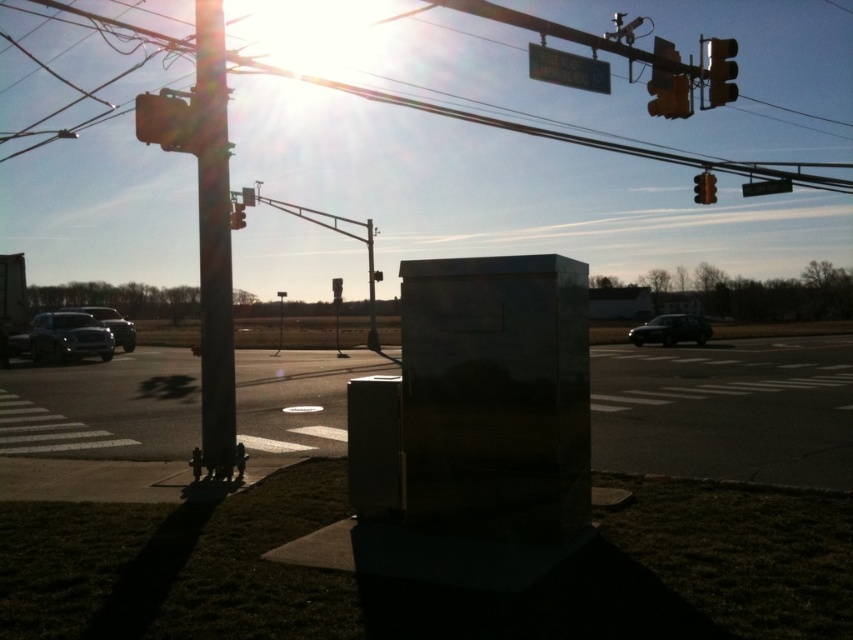
You are a city planner reviewing the street layout. You need to determine the vertical positioning of the metallic pole at center and the metallic at upper center. Which one is positioned higher in the image?

The metallic pole at center is positioned higher than the metallic at upper center in the image.

You are a delivery person trying to park your motorcycle between the metallic pole at left and the shiny black sedan at center. Can your motorcycle, which is 1.2 meters wide, fit in the space between them?

The metallic pole at left has a lesser width compared to shiny black sedan at center. However, the description does not provide information about the distance between them, so it is impossible to determine if the motorcycle can fit.